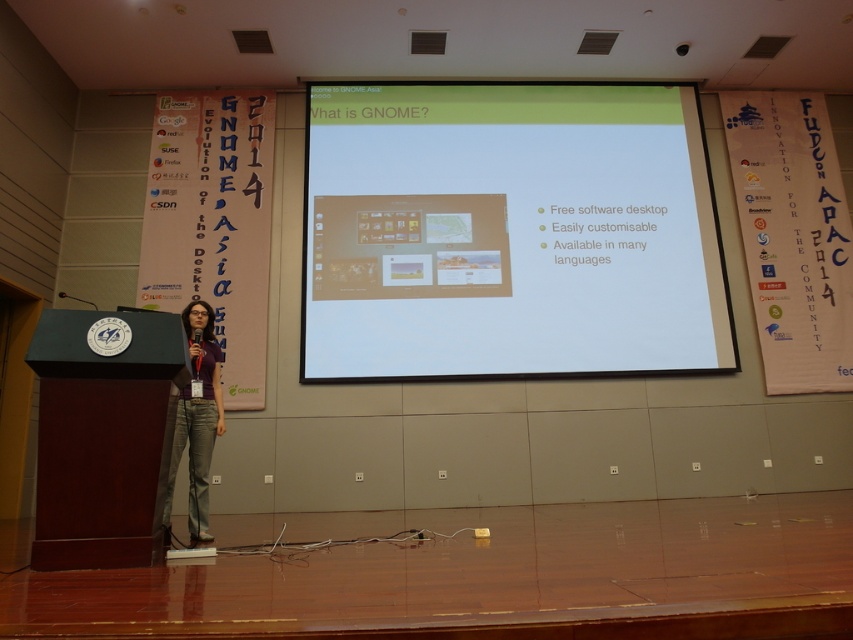
You are an attendee in the conference hall and want to take a photo of the speaker. Since the dark wood podium at center is blocking your view, can you move to the left side to capture the speaker, the matte purple shirt at center, without the podium obstructing the view?

The dark wood podium at center is in front of the matte purple shirt at center, so moving to the left side might not fully remove the podium from the frame. You might need to adjust your position further to ensure the podium isn not blocking the view of the matte purple shirt at center.